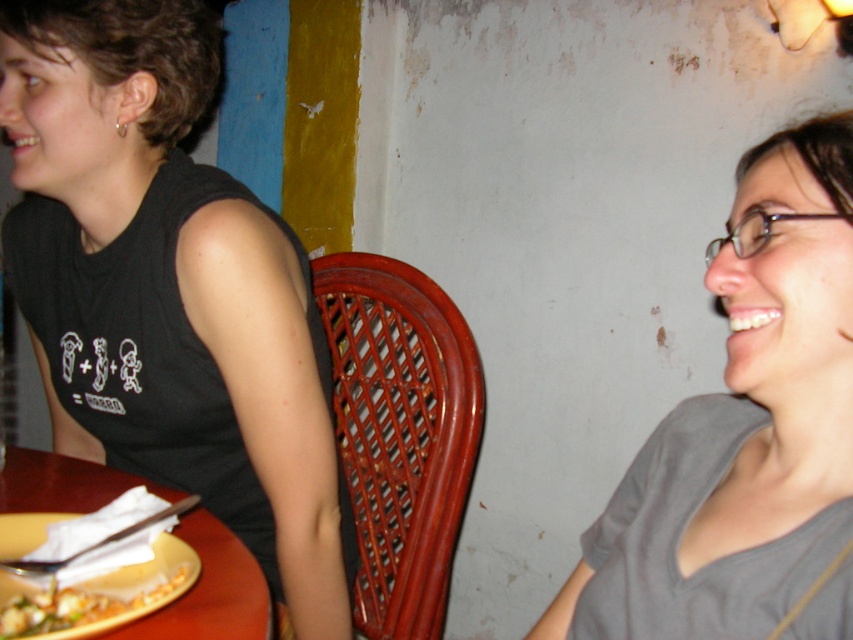
You are a photographer trying to capture a portrait of both individuals. Since you want to ensure both are fully visible, you need to know which object is wider. Which one is wider between the gray matte shirt at upper right and the wooden table at lower left?

The wooden table at lower left is wider than the gray matte shirt at upper right, so the photographer should frame the shot to accommodate the wider wooden table at lower left to ensure both individuals are fully visible.

You are a photographer taking a picture of the black matte tank top at left and the yellow matte plate at lower left. Since the camera can only focus on one object at a time, which object should you focus on to ensure it appears larger in the photo?

The black matte tank top at left is much taller than the yellow matte plate at lower left, so focusing on the black matte tank top at left will ensure it appears larger in the photo.

You are a photographer trying to capture a closeup of the yellow matte plate at lower left without the black matte tank top at left being in the frame. Given their sizes, is it possible to do so?

The black matte tank top at left is bigger than the yellow matte plate at lower left. Therefore, it might be challenging to frame the yellow matte plate at lower left without including the black matte tank top at left due to its larger size.